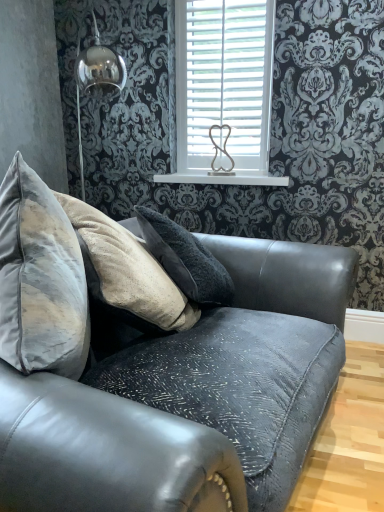
What do you see at coordinates (223, 92) in the screenshot? I see `white wooden blinds at upper center` at bounding box center [223, 92].

Describe the element at coordinates (223, 178) in the screenshot. I see `white glossy shelf at upper center` at that location.

This screenshot has width=384, height=512. Identify the location of velvet grey couch at center. (160, 374).

Is velvet grey couch at center at the back of white glossy shelf at upper center?

white glossy shelf at upper center is not turned away from velvet grey couch at center.

From the image's perspective, is white glossy shelf at upper center on velvet grey couch at center?

Correct, white glossy shelf at upper center appears higher than velvet grey couch at center in the image.

You are a GUI agent. You are given a task and a screenshot of the screen. Output one action in this format:
    pyautogui.click(x=<x>, y=<y>)
    Task: Click on the window sill above the velvet grey couch at center (from a real-world perspective)
    This screenshot has width=384, height=512.
    Given the screenshot: What is the action you would take?
    pyautogui.click(x=223, y=178)

Which object is positioned more to the right, white glossy shelf at upper center or velvet grey couch at center?

white glossy shelf at upper center.

Is white glossy shelf at upper center in front of or behind white wooden blinds at upper center in the image?

Clearly, white glossy shelf at upper center is behind white wooden blinds at upper center.

Is white wooden blinds at upper center at the back of white glossy shelf at upper center?

That's not correct — white glossy shelf at upper center is not looking away from white wooden blinds at upper center.

Which is more to the left, white glossy shelf at upper center or white wooden blinds at upper center?

white glossy shelf at upper center.

At what (x,y) coordinates should I click in order to perform the action: click on window above the velvet grey couch at center (from a real-world perspective). Please return your answer as a coordinate pair (x, y). This screenshot has width=384, height=512. Looking at the image, I should click on (223, 92).

Is velvet grey couch at center located outside white wooden blinds at upper center?

Absolutely, velvet grey couch at center is external to white wooden blinds at upper center.

Who is shorter, velvet grey couch at center or white wooden blinds at upper center?

velvet grey couch at center.

How far apart are velvet grey couch at center and white wooden blinds at upper center?

velvet grey couch at center is 1.19 meters from white wooden blinds at upper center.

From a real-world perspective, does white wooden blinds at upper center sit lower than velvet grey couch at center?

Actually, white wooden blinds at upper center is physically above velvet grey couch at center in the real world.

Is white wooden blinds at upper center inside or outside of velvet grey couch at center?

The correct answer is: outside.

From the image's perspective, is white wooden blinds at upper center beneath velvet grey couch at center?

No, from the image's perspective, white wooden blinds at upper center is not below velvet grey couch at center.

From the image's perspective, between velvet grey couch at center and white glossy shelf at upper center, who is located below?

velvet grey couch at center appears lower in the image.

At what (x,y) coordinates should I click in order to perform the action: click on window sill above the velvet grey couch at center (from a real-world perspective). Please return your answer as a coordinate pair (x, y). Looking at the image, I should click on (223, 178).

Is white glossy shelf at upper center completely or partially inside velvet grey couch at center?

No, velvet grey couch at center does not contain white glossy shelf at upper center.

Considering the points (25, 296) and (269, 183), which point is behind, point (25, 296) or point (269, 183)?

The point (269, 183) is more distant.

Is white wooden blinds at upper center further to the viewer compared to white glossy shelf at upper center?

No, the depth of white wooden blinds at upper center is less than that of white glossy shelf at upper center.

Can you confirm if white wooden blinds at upper center is taller than white glossy shelf at upper center?

Yes, white wooden blinds at upper center is taller than white glossy shelf at upper center.

Would you say white wooden blinds at upper center is outside white glossy shelf at upper center?

Yes, white wooden blinds at upper center is located beyond the bounds of white glossy shelf at upper center.

The height and width of the screenshot is (512, 384). In order to click on studio couch that is on the left side of white glossy shelf at upper center in this screenshot , I will do `click(160, 374)`.

Locate an element on the screen. The image size is (384, 512). window sill below the white wooden blinds at upper center (from the image's perspective) is located at coordinates point(223,178).

From the image, which object appears to be farther from white wooden blinds at upper center, white glossy shelf at upper center or velvet grey couch at center?

velvet grey couch at center.

Which object lies nearer to the anchor point white glossy shelf at upper center, velvet grey couch at center or white wooden blinds at upper center?

white wooden blinds at upper center.

Which object lies nearer to the anchor point white wooden blinds at upper center, velvet grey couch at center or white glossy shelf at upper center?

Answer: white glossy shelf at upper center is positioned closer to the anchor white wooden blinds at upper center.

Estimate the real-world distances between objects in this image. Which object is further from velvet grey couch at center, white wooden blinds at upper center or white glossy shelf at upper center?

The object further to velvet grey couch at center is white glossy shelf at upper center.

From the image, which object appears to be farther from velvet grey couch at center, white glossy shelf at upper center or white wooden blinds at upper center?

Among the two, white glossy shelf at upper center is located further to velvet grey couch at center.

Considering their positions, is white wooden blinds at upper center positioned closer to white glossy shelf at upper center than velvet grey couch at center?

The object closer to white glossy shelf at upper center is white wooden blinds at upper center.

The height and width of the screenshot is (512, 384). Identify the location of window between velvet grey couch at center and white glossy shelf at upper center in the front-back direction. (223, 92).